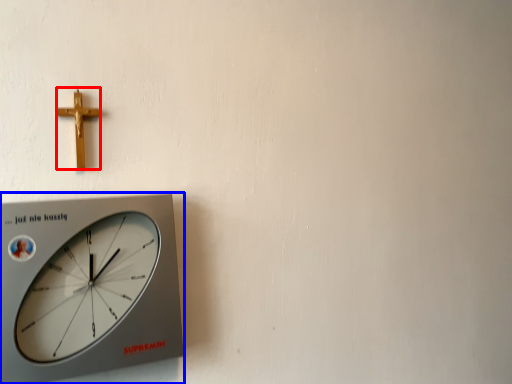
Question: Which point is closer to the camera, crucifix (highlighted by a red box) or wall clock (highlighted by a blue box)?

Choices:
 (A) crucifix
 (B) wall clock

Answer: (B)